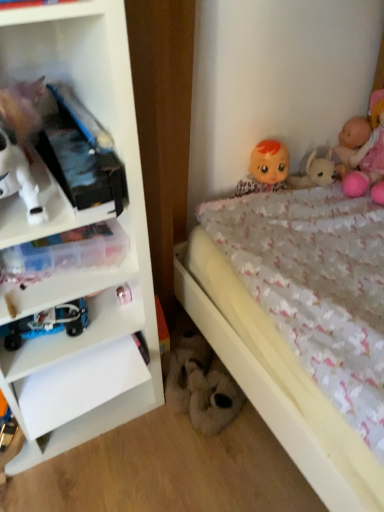
Question: Is pink plush doll at upper right, the 1th doll viewed from the right, wider than metallic silver toy at lower left, the second toy from the right?

Choices:
 (A) yes
 (B) no

Answer: (A)

Question: From a real-world perspective, is pink plush doll at upper right, the 1th doll viewed from the right, below metallic silver toy at lower left, marked as the 2th toy in a front-to-back arrangement?

Choices:
 (A) yes
 (B) no

Answer: (B)

Question: Is pink plush doll at upper right, the 1th doll viewed from the right, beside metallic silver toy at lower left, which appears as the second toy when viewed from the left?

Choices:
 (A) yes
 (B) no

Answer: (B)

Question: Could you tell me if pink plush doll at upper right, the 1th doll viewed from the right, is facing metallic silver toy at lower left, the 1th toy viewed from the top?

Choices:
 (A) yes
 (B) no

Answer: (B)

Question: From a real-world perspective, does pink plush doll at upper right, the 1th doll viewed from the right, stand above metallic silver toy at lower left, which appears as the second toy when viewed from the left?

Choices:
 (A) yes
 (B) no

Answer: (A)

Question: Do you think metallic silver toy at lower left, the second toy from the right, is within pink plush doll at upper right, the third doll viewed from the left, or outside of it?

Choices:
 (A) inside
 (B) outside

Answer: (B)

Question: In terms of height, does metallic silver toy at lower left, the 1th toy viewed from the top, look taller or shorter compared to pink plush doll at upper right, the third doll viewed from the left?

Choices:
 (A) tall
 (B) short

Answer: (B)

Question: Visually, is metallic silver toy at lower left, the 3th toy from the bottom, positioned to the left or to the right of pink plush doll at upper right, the 1th doll viewed from the right?

Choices:
 (A) right
 (B) left

Answer: (B)

Question: From a real-world perspective, is metallic silver toy at lower left, which appears as the second toy when viewed from the back, positioned above or below pink plush doll at upper right, the 1th doll viewed from the right?

Choices:
 (A) above
 (B) below

Answer: (B)

Question: From a real-world perspective, relative to pink plush doll at upper right, the third doll viewed from the left, is blue metallic car at lower left, the third toy from the right, vertically above or below?

Choices:
 (A) below
 (B) above

Answer: (A)

Question: Considering the positions of blue metallic car at lower left, which ranks as the second toy in top-to-bottom order, and pink plush doll at upper right, the third doll viewed from the left, in the image, is blue metallic car at lower left, which ranks as the second toy in top-to-bottom order, bigger or smaller than pink plush doll at upper right, the third doll viewed from the left,?

Choices:
 (A) small
 (B) big

Answer: (A)

Question: Considering the positions of blue metallic car at lower left, which is the third toy from back to front, and pink plush doll at upper right, the 1th doll viewed from the right, in the image, is blue metallic car at lower left, which is the third toy from back to front, wider or thinner than pink plush doll at upper right, the 1th doll viewed from the right,?

Choices:
 (A) wide
 (B) thin

Answer: (B)

Question: Considering the positions of point (74, 306) and point (357, 184), is point (74, 306) closer or farther from the camera than point (357, 184)?

Choices:
 (A) closer
 (B) farther

Answer: (A)

Question: Choose the correct answer: Is metallic silver toy at lower left, marked as the 2th toy in a front-to-back arrangement, inside smooth plastic doll at upper right, marked as the 3th doll in a right-to-left arrangement, or outside it?

Choices:
 (A) inside
 (B) outside

Answer: (B)

Question: Is point (122, 287) positioned closer to the camera than point (269, 187)?

Choices:
 (A) closer
 (B) farther

Answer: (A)